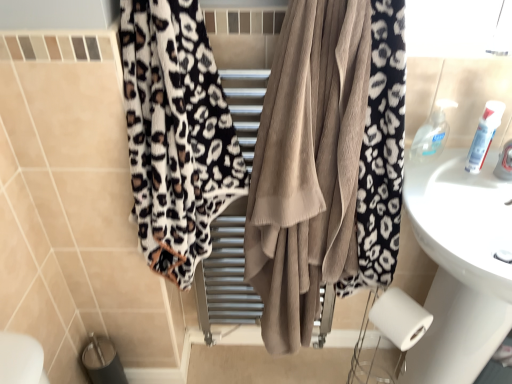
Question: Considering the relative positions of clear plastic soap dispenser at upper right, the first toiletry viewed from the left, and leopard print fabric at left, which appears as the first curtain when viewed from the left, in the image provided, is clear plastic soap dispenser at upper right, the first toiletry viewed from the left, to the right of leopard print fabric at left, which appears as the first curtain when viewed from the left, from the viewer's perspective?

Choices:
 (A) no
 (B) yes

Answer: (B)

Question: Is the depth of clear plastic soap dispenser at upper right, the second toiletry when ordered from right to left, greater than that of leopard print fabric at left, which appears as the first curtain when viewed from the left?

Choices:
 (A) yes
 (B) no

Answer: (A)

Question: From the image's perspective, does clear plastic soap dispenser at upper right, the second toiletry when ordered from right to left, appear higher than leopard print fabric at left, positioned as the second curtain in right-to-left order?

Choices:
 (A) yes
 (B) no

Answer: (A)

Question: Is leopard print fabric at left, positioned as the second curtain in right-to-left order, located within clear plastic soap dispenser at upper right, the second toiletry when ordered from right to left?

Choices:
 (A) no
 (B) yes

Answer: (A)

Question: Are clear plastic soap dispenser at upper right, the first toiletry viewed from the left, and leopard print fabric at left, which appears as the first curtain when viewed from the left, beside each other?

Choices:
 (A) yes
 (B) no

Answer: (B)

Question: Considering the relative sizes of clear plastic soap dispenser at upper right, the first toiletry viewed from the left, and leopard print fabric at left, positioned as the second curtain in right-to-left order, in the image provided, is clear plastic soap dispenser at upper right, the first toiletry viewed from the left, wider than leopard print fabric at left, positioned as the second curtain in right-to-left order,?

Choices:
 (A) yes
 (B) no

Answer: (B)

Question: Is white glossy tube at upper right, the 1th toiletry positioned from the right, completely or partially inside clear plastic soap dispenser at upper right, the first toiletry viewed from the left?

Choices:
 (A) yes
 (B) no

Answer: (B)

Question: Is clear plastic soap dispenser at upper right, the first toiletry viewed from the left, smaller than white glossy tube at upper right, the 1th toiletry positioned from the right?

Choices:
 (A) yes
 (B) no

Answer: (B)

Question: Is clear plastic soap dispenser at upper right, the first toiletry viewed from the left, at the right side of white glossy tube at upper right, which appears as the 2th toiletry when viewed from the left?

Choices:
 (A) yes
 (B) no

Answer: (B)

Question: Is clear plastic soap dispenser at upper right, the second toiletry when ordered from right to left, positioned in front of white glossy tube at upper right, which appears as the 2th toiletry when viewed from the left?

Choices:
 (A) yes
 (B) no

Answer: (B)

Question: From a real-world perspective, is clear plastic soap dispenser at upper right, the first toiletry viewed from the left, physically below white glossy tube at upper right, the 1th toiletry positioned from the right?

Choices:
 (A) yes
 (B) no

Answer: (A)

Question: Does clear plastic soap dispenser at upper right, the second toiletry when ordered from right to left, have a greater height compared to white glossy tube at upper right, which appears as the 2th toiletry when viewed from the left?

Choices:
 (A) yes
 (B) no

Answer: (B)

Question: Can you confirm if leopard print fabric at left, which appears as the first curtain when viewed from the left, is taller than leopard print towel at center, which is the first curtain in right-to-left order?

Choices:
 (A) no
 (B) yes

Answer: (A)